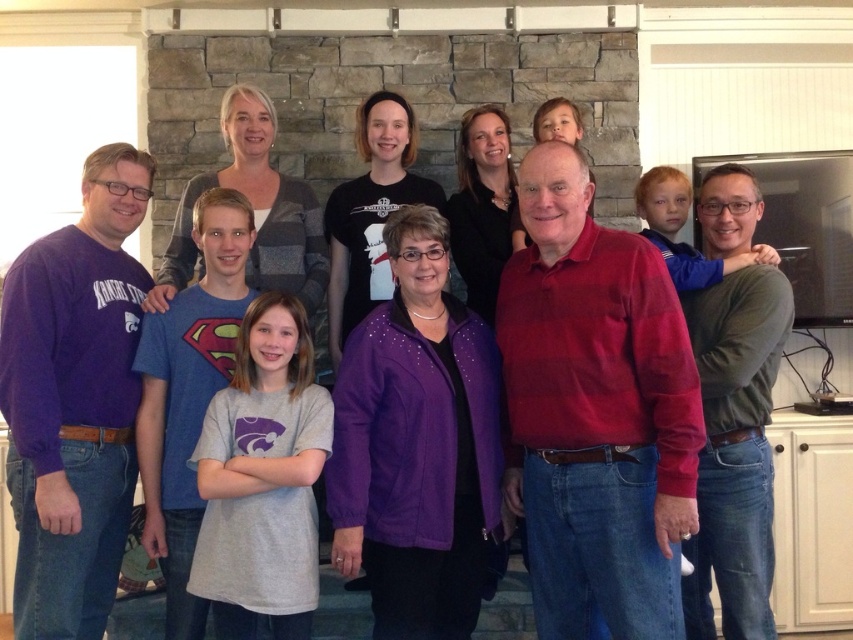
Between purple fleece jacket at center and purple fleece sweatshirt at left, which one appears on the right side from the viewer's perspective?

purple fleece jacket at center is more to the right.

Can you confirm if purple fleece jacket at center is positioned to the right of purple fleece sweatshirt at left?

Yes, purple fleece jacket at center is to the right of purple fleece sweatshirt at left.

Is point (412, 296) less distant than point (117, 262)?

Yes, it is.

Locate an element on the screen. purple fleece jacket at center is located at coordinates (418, 445).

Based on the photo, can you confirm if purple fleece jacket at center is positioned above green sweater at center?

Incorrect, purple fleece jacket at center is not positioned above green sweater at center.

Can you confirm if purple fleece jacket at center is wider than green sweater at center?

Yes.

Which is in front, point (407, 428) or point (764, 564)?

Positioned in front is point (407, 428).

You are a GUI agent. You are given a task and a screenshot of the screen. Output one action in this format:
    pyautogui.click(x=<x>, y=<y>)
    Task: Click on the purple fleece jacket at center
    This screenshot has height=640, width=853.
    Given the screenshot: What is the action you would take?
    pyautogui.click(x=418, y=445)

In the scene shown: Does red plaid shirt at center appear on the right side of green sweater at center?

In fact, red plaid shirt at center is to the left of green sweater at center.

Between red plaid shirt at center and green sweater at center, which one has more height?

green sweater at center is taller.

You are a GUI agent. You are given a task and a screenshot of the screen. Output one action in this format:
    pyautogui.click(x=<x>, y=<y>)
    Task: Click on the red plaid shirt at center
    
    Given the screenshot: What is the action you would take?
    pyautogui.click(x=596, y=412)

The height and width of the screenshot is (640, 853). I want to click on red plaid shirt at center, so click(596, 412).